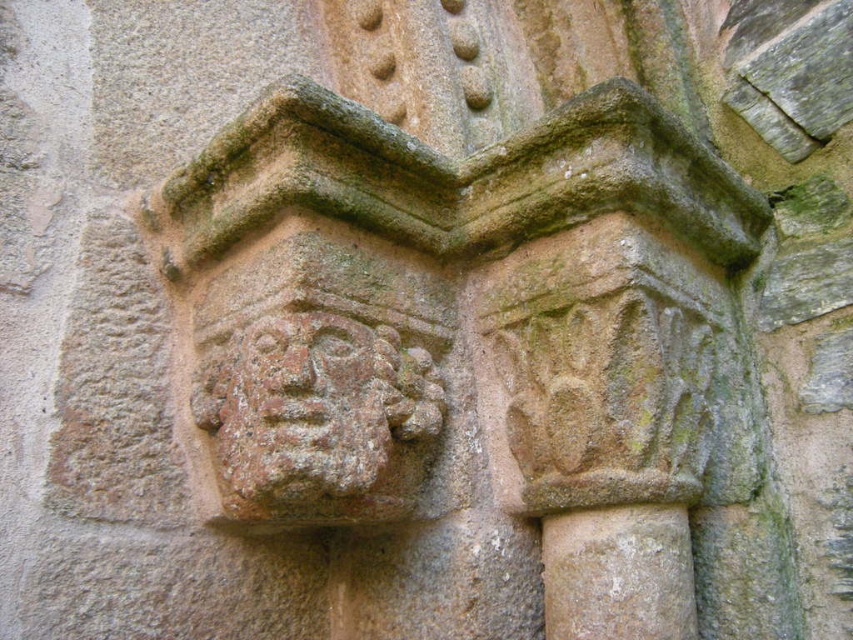
Question: Can you confirm if brown stone carving at center is bigger than rustic stone face at center?

Choices:
 (A) no
 (B) yes

Answer: (B)

Question: Is brown stone carving at center positioned before rustic stone face at center?

Choices:
 (A) no
 (B) yes

Answer: (B)

Question: Which of the following is the closest to the observer?

Choices:
 (A) brown stone carving at center
 (B) rustic stone face at center

Answer: (A)

Question: Does brown stone carving at center have a greater width compared to rustic stone face at center?

Choices:
 (A) yes
 (B) no

Answer: (A)

Question: Which of the following is the closest to the observer?

Choices:
 (A) rustic stone face at center
 (B) brown stone carving at center

Answer: (B)